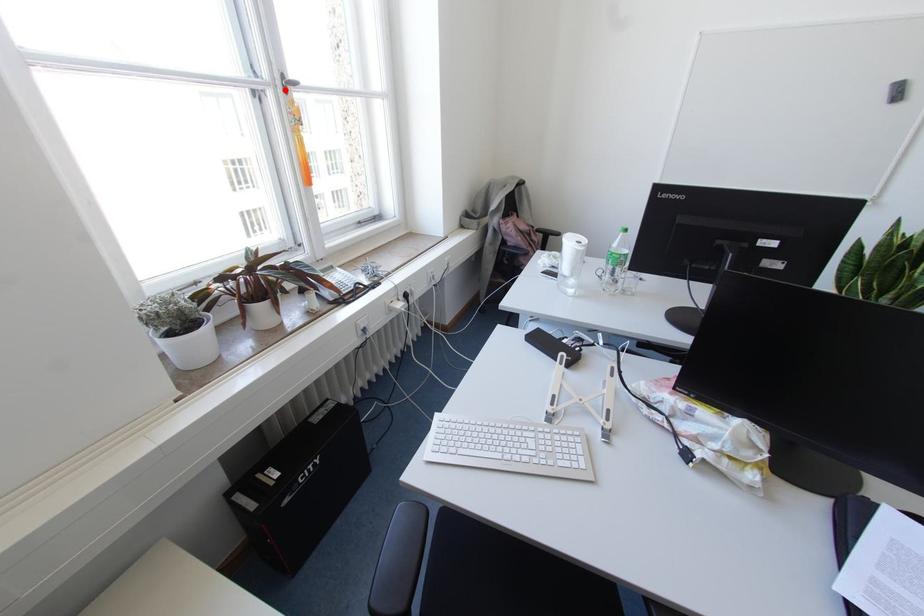
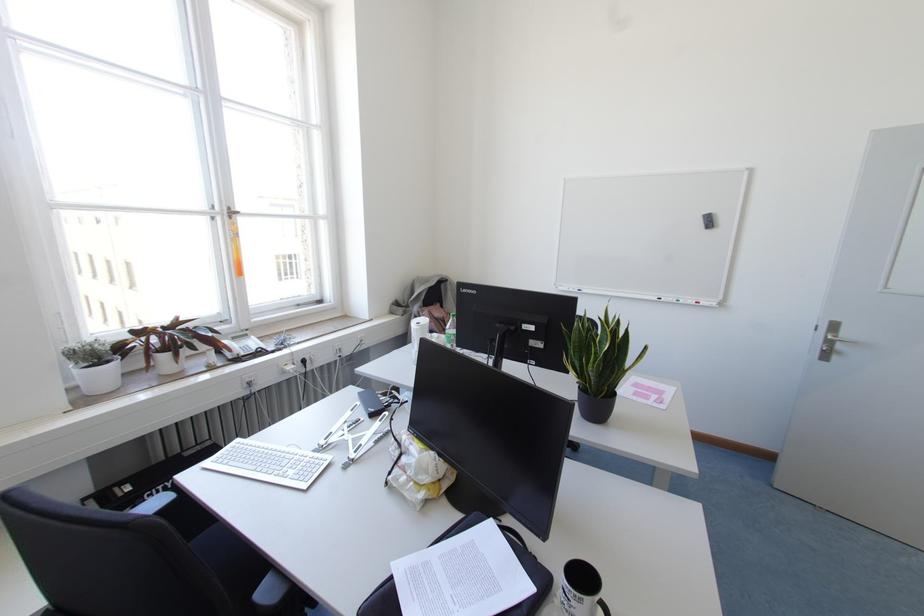
Locate, in the second image, the point that corresponds to the highlighted location in the first image.

(229, 217)